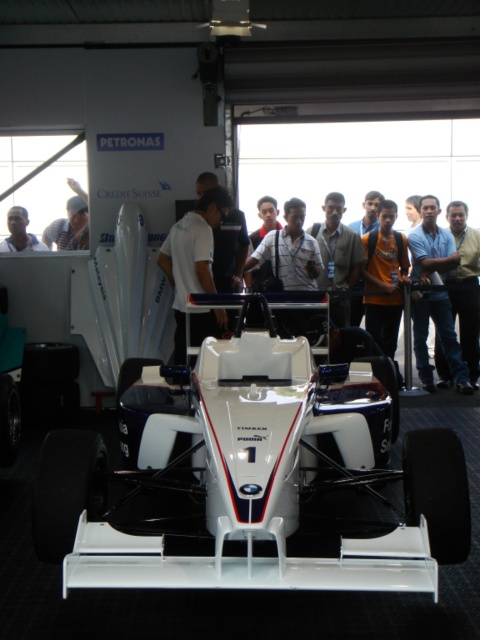
Question: Which point appears closest to the camera in this image?

Choices:
 (A) (183, 301)
 (B) (363, 275)

Answer: (A)

Question: Does white smooth shirt at center have a lesser width compared to white matte shirt at center?

Choices:
 (A) yes
 (B) no

Answer: (A)

Question: Can you confirm if white smooth shirt at center is bigger than blue fabric shirt at right?

Choices:
 (A) yes
 (B) no

Answer: (A)

Question: Estimate the real-world distances between objects in this image. Which object is farther from the blue fabric shirt at right?

Choices:
 (A) orange fabric shirt at center
 (B) light brown leather shirt at center
 (C) white smooth shirt at center
 (D) white matte shirt at center

Answer: (C)

Question: Does orange fabric shirt at center appear over light brown leather shirt at center?

Choices:
 (A) yes
 (B) no

Answer: (B)

Question: Among these objects, which one is farthest from the camera?

Choices:
 (A) white smooth shirt at center
 (B) light brown leather shirt at center

Answer: (B)